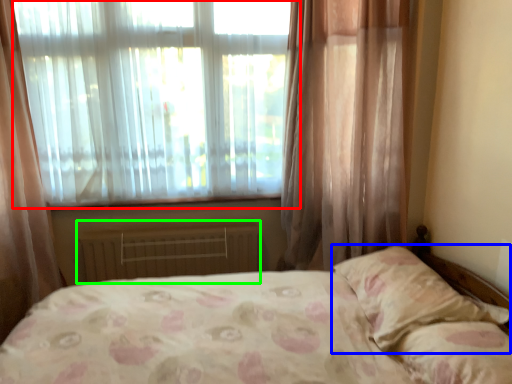
Question: Estimate the real-world distances between objects in this image. Which object is closer to window (highlighted by a red box), pillow (highlighted by a blue box) or radiator (highlighted by a green box)?

Choices:
 (A) pillow
 (B) radiator

Answer: (B)